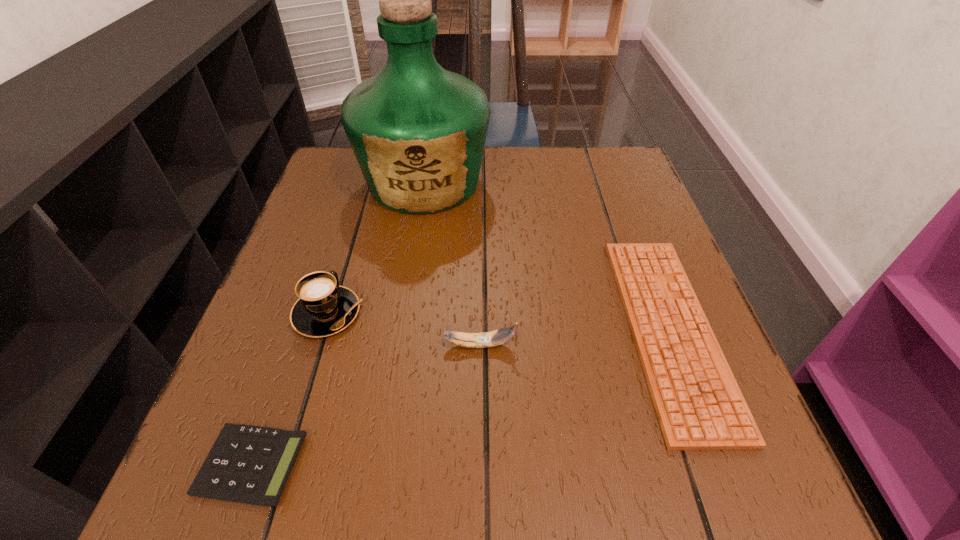
This screenshot has height=540, width=960. I want to click on liquor, so click(418, 131).

Where is `the farthest object`? the farthest object is located at coordinates (418, 131).

Locate an element on the screen. The height and width of the screenshot is (540, 960). cappuccino is located at coordinates click(324, 308).

Find the location of `banana`. banana is located at coordinates (497, 337).

The width and height of the screenshot is (960, 540). Find the location of `computer keyboard`. computer keyboard is located at coordinates (699, 405).

Where is `calculator`? The image size is (960, 540). calculator is located at coordinates (247, 464).

In order to click on free space located 0.200m on the label side of the farthest object in this screenshot , I will do `click(407, 290)`.

The width and height of the screenshot is (960, 540). Identify the location of vacant region located on the back of the cappuccino. (348, 243).

You are a GUI agent. You are given a task and a screenshot of the screen. Output one action in this format:
    pyautogui.click(x=<x>, y=<y>)
    Task: Click on the vacant space positioned at the stem of the banana
    Image resolution: width=960 pixels, height=540 pixels.
    Given the screenshot: What is the action you would take?
    pyautogui.click(x=574, y=345)

Where is `free space located 0.050m on the back of the rightmost object`? free space located 0.050m on the back of the rightmost object is located at coordinates (633, 233).